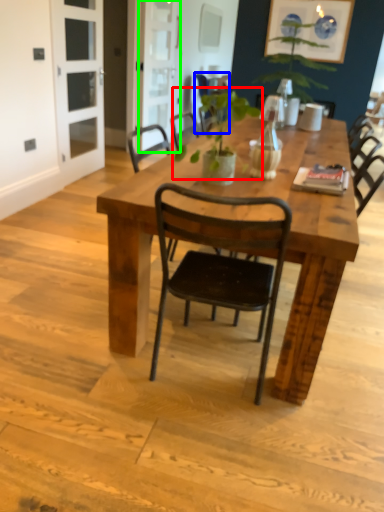
Question: Which object is positioned closest to plant (highlighted by a red box)? Select from chair (highlighted by a blue box) and screen door (highlighted by a green box).

Choices:
 (A) chair
 (B) screen door

Answer: (A)